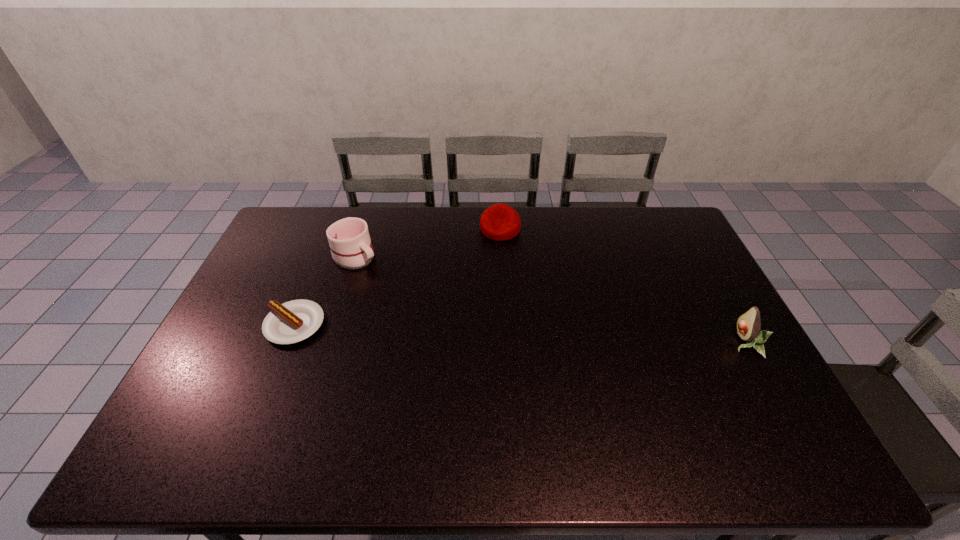
The height and width of the screenshot is (540, 960). I want to click on vacant space on the desktop that is between the shortest object and the avocado and is positioned on the seat area of the third tallest object, so click(497, 333).

Locate an element on the screen. The width and height of the screenshot is (960, 540). free spot on the desktop that is between the sausage and the avocado and is positioned on the side with the handle of the mug is located at coordinates coord(449,331).